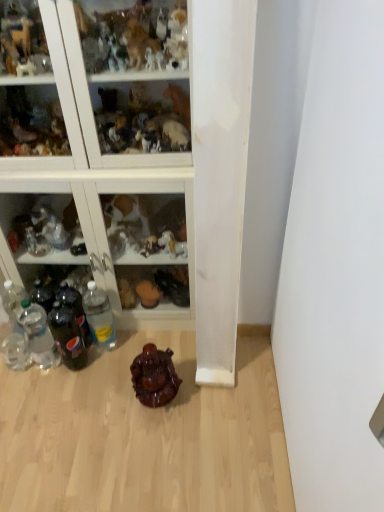
Locate an element on the screen. free space between clear plastic bottles at left, the 4th bottle when ordered from right to left, and shiny brown statue at center is located at coordinates (102, 381).